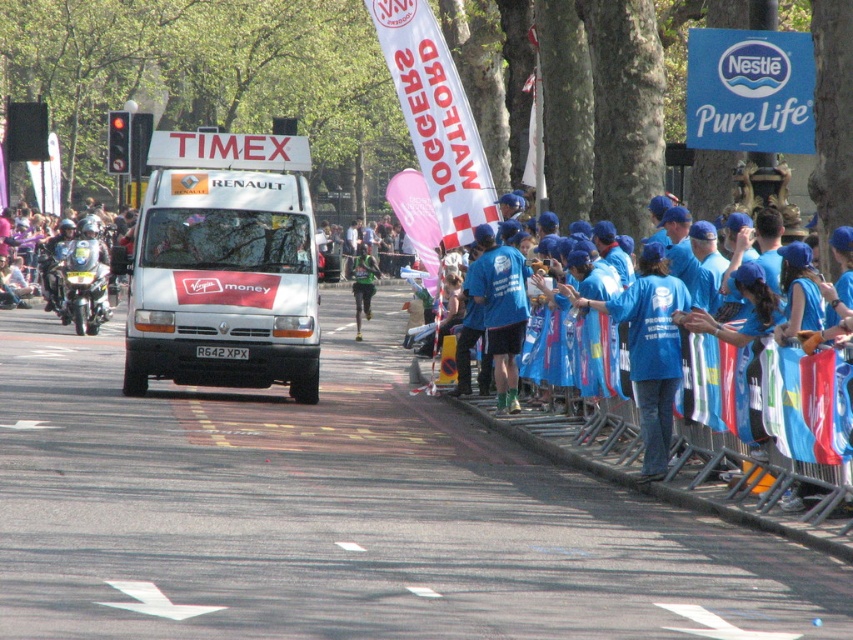
Does point (143, 257) lie in front of point (354, 301)?

That is True.

Does point (207, 188) lie in front of point (363, 291)?

That is True.

The width and height of the screenshot is (853, 640). In order to click on white matte van at center in this screenshot , I will do `click(223, 266)`.

Is blue fabric shirt at center wider than green fabric runner at center?

No, blue fabric shirt at center is not wider than green fabric runner at center.

Between point (631, 314) and point (368, 314), which one is positioned in front?

Point (631, 314) is in front.

In order to click on blue fabric shirt at center in this screenshot , I will do `click(650, 349)`.

Does white matte van at center have a greater width compared to blue fabric shirt at center?

No, white matte van at center is not wider than blue fabric shirt at center.

Between white matte van at center and blue fabric shirt at center, which one has more height?

With more height is blue fabric shirt at center.

Find the location of `white matte van at center`. white matte van at center is located at coordinates (223, 266).

Locate an element on the screen. white matte van at center is located at coordinates (223, 266).